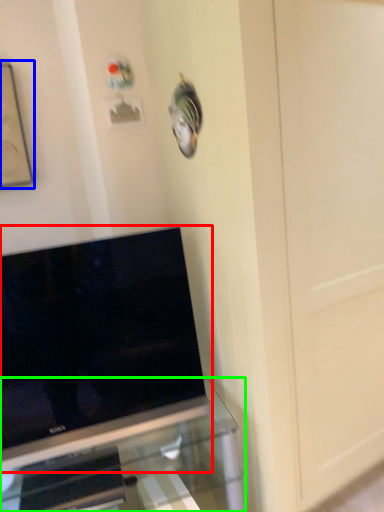
Question: Based on their relative distances, which object is nearer to television (highlighted by a red box)? Choose from picture frame (highlighted by a blue box) and furniture (highlighted by a green box).

Choices:
 (A) picture frame
 (B) furniture

Answer: (B)